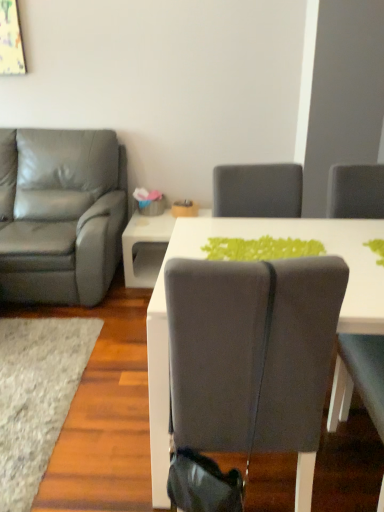
Question: Is matte gray leather armchair at left, which ranks as the second chair in right-to-left order, surrounding matte gray chair at center, the second chair viewed from the left?

Choices:
 (A) no
 (B) yes

Answer: (A)

Question: Is matte gray leather armchair at left, marked as the 1th chair in a left-to-right arrangement, looking in the opposite direction of matte gray chair at center, the first chair from the right?

Choices:
 (A) no
 (B) yes

Answer: (A)

Question: Does matte gray leather armchair at left, acting as the 2th chair starting from the front, turn towards matte gray chair at center, the first chair from the right?

Choices:
 (A) yes
 (B) no

Answer: (B)

Question: Considering the relative sizes of matte gray leather armchair at left, which ranks as the second chair in right-to-left order, and matte gray chair at center, marked as the 2th chair in a back-to-front arrangement, in the image provided, is matte gray leather armchair at left, which ranks as the second chair in right-to-left order, bigger than matte gray chair at center, marked as the 2th chair in a back-to-front arrangement,?

Choices:
 (A) no
 (B) yes

Answer: (B)

Question: Does matte gray leather armchair at left, acting as the 2th chair starting from the front, come behind matte gray chair at center, the first chair from the right?

Choices:
 (A) yes
 (B) no

Answer: (A)

Question: From a real-world perspective, relative to matte gray chair at center, the second chair viewed from the left, is soft gray carpet at lower left vertically above or below?

Choices:
 (A) below
 (B) above

Answer: (A)

Question: Choose the correct answer: Is soft gray carpet at lower left inside matte gray chair at center, marked as the 2th chair in a back-to-front arrangement, or outside it?

Choices:
 (A) inside
 (B) outside

Answer: (B)

Question: Is soft gray carpet at lower left bigger or smaller than matte gray chair at center, the 1th chair from the front?

Choices:
 (A) big
 (B) small

Answer: (B)

Question: Visually, is soft gray carpet at lower left positioned to the left or to the right of matte gray chair at center, marked as the 2th chair in a back-to-front arrangement?

Choices:
 (A) left
 (B) right

Answer: (A)

Question: Is white glossy table at center to the left or to the right of matte gray leather armchair at left, which ranks as the second chair in right-to-left order, in the image?

Choices:
 (A) right
 (B) left

Answer: (A)

Question: Considering the positions of point (130, 223) and point (61, 130), is point (130, 223) closer or farther from the camera than point (61, 130)?

Choices:
 (A) farther
 (B) closer

Answer: (B)

Question: Considering the positions of white glossy table at center and matte gray leather armchair at left, which ranks as the second chair in right-to-left order, in the image, is white glossy table at center taller or shorter than matte gray leather armchair at left, which ranks as the second chair in right-to-left order,?

Choices:
 (A) tall
 (B) short

Answer: (B)

Question: Choose the correct answer: Is white glossy table at center inside matte gray leather armchair at left, positioned as the first chair in back-to-front order, or outside it?

Choices:
 (A) outside
 (B) inside

Answer: (A)

Question: From a real-world perspective, is matte gray leather armchair at left, which ranks as the second chair in right-to-left order, physically located above or below soft gray carpet at lower left?

Choices:
 (A) below
 (B) above

Answer: (B)

Question: Is matte gray leather armchair at left, marked as the 1th chair in a left-to-right arrangement, bigger or smaller than soft gray carpet at lower left?

Choices:
 (A) small
 (B) big

Answer: (B)